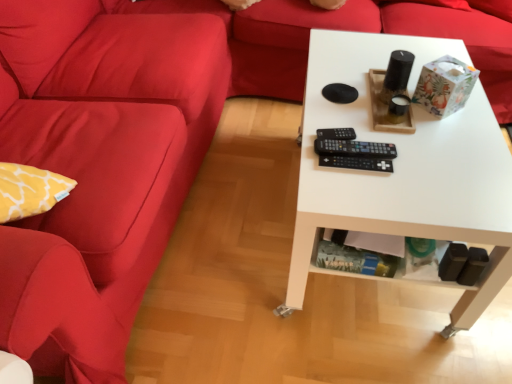
Locate an element on the screen. The image size is (512, 384). free region on the left part of white matte table at center is located at coordinates (232, 241).